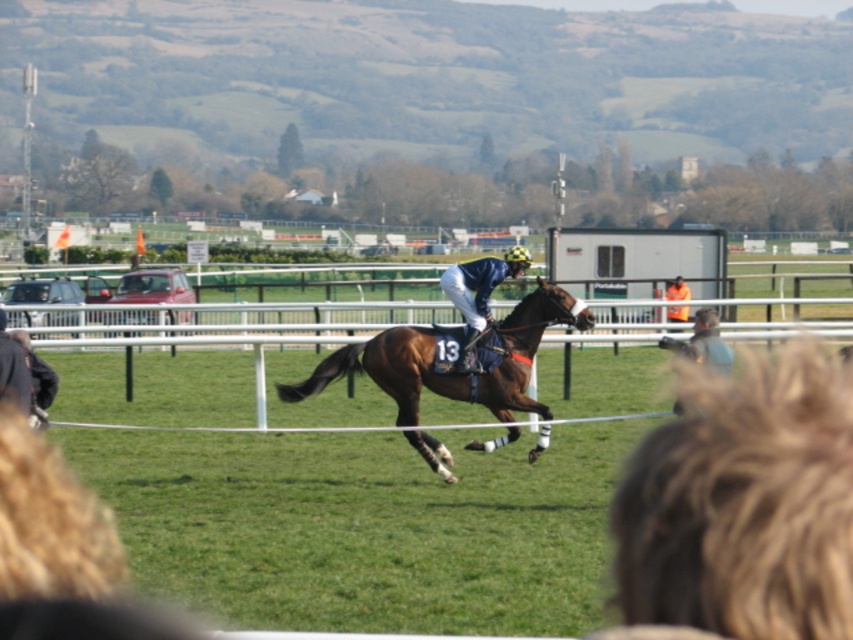
Is blue denim jacket at center shorter than orange fabric at center?

Correct, blue denim jacket at center is not as tall as orange fabric at center.

Is blue denim jacket at center further to camera compared to orange fabric at center?

No.

Between point (619, 540) and point (680, 310), which one is positioned in front?

Point (619, 540)

The width and height of the screenshot is (853, 640). Identify the location of blue denim jacket at center. (741, 504).

Is shiny brown horse at center positioned behind blue fabric jockey at center?

No, shiny brown horse at center is closer to the viewer.

Does shiny brown horse at center have a smaller size compared to blue fabric jockey at center?

Actually, shiny brown horse at center might be larger than blue fabric jockey at center.

Where is `shiny brown horse at center`? shiny brown horse at center is located at coordinates (450, 369).

In the scene shown: Who is lower down, blue fabric jockey at center or orange fabric at center?

blue fabric jockey at center

The height and width of the screenshot is (640, 853). Identify the location of blue fabric jockey at center. (479, 292).

Is point (508, 266) farther from camera compared to point (670, 317)?

No.

You are a GUI agent. You are given a task and a screenshot of the screen. Output one action in this format:
    pyautogui.click(x=<x>, y=<y>)
    Task: Click on the blue fabric jockey at center
    
    Given the screenshot: What is the action you would take?
    pyautogui.click(x=479, y=292)